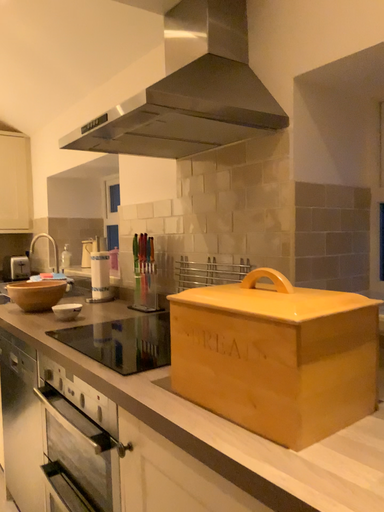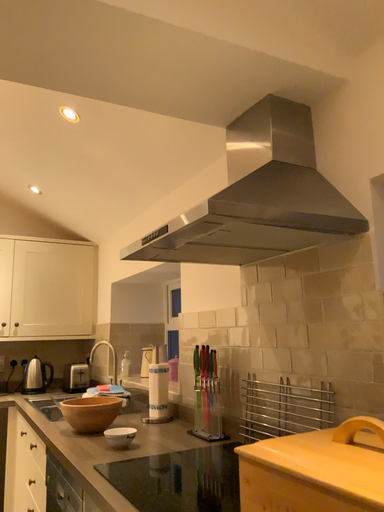
Question: How did the camera likely rotate when shooting the video?

Choices:
 (A) rotated upward
 (B) rotated downward

Answer: (A)